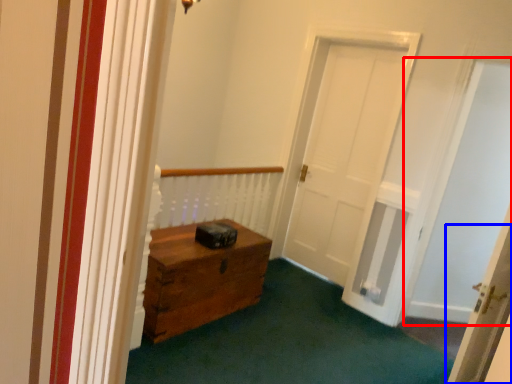
Question: Which point is further to the camera, passage (highlighted by a red box) or door (highlighted by a blue box)?

Choices:
 (A) passage
 (B) door

Answer: (A)